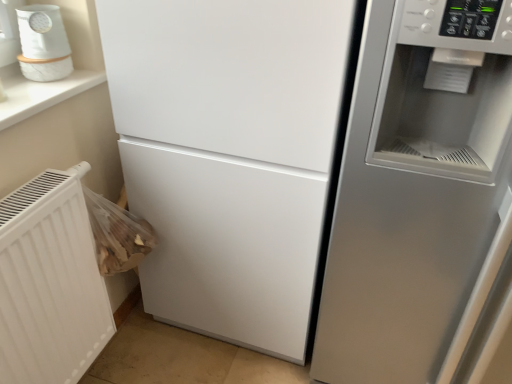
Question: From a real-world perspective, is satin silver fridge at right under white textured radiator at lower left?

Choices:
 (A) yes
 (B) no

Answer: (B)

Question: Does satin silver fridge at right have a larger size compared to white textured radiator at lower left?

Choices:
 (A) yes
 (B) no

Answer: (A)

Question: Is satin silver fridge at right wider than white textured radiator at lower left?

Choices:
 (A) yes
 (B) no

Answer: (A)

Question: Does satin silver fridge at right have a greater height compared to white textured radiator at lower left?

Choices:
 (A) yes
 (B) no

Answer: (A)

Question: Considering the relative positions of satin silver fridge at right and white textured radiator at lower left in the image provided, is satin silver fridge at right behind white textured radiator at lower left?

Choices:
 (A) no
 (B) yes

Answer: (A)

Question: Based on their positions, is white glossy humidifier at upper left located to the left or right of satin silver fridge at right?

Choices:
 (A) left
 (B) right

Answer: (A)

Question: Would you say white glossy humidifier at upper left is inside or outside satin silver fridge at right?

Choices:
 (A) inside
 (B) outside

Answer: (B)

Question: In the image, is white glossy humidifier at upper left positioned in front of or behind satin silver fridge at right?

Choices:
 (A) behind
 (B) front

Answer: (A)

Question: From a real-world perspective, relative to satin silver fridge at right, is white glossy humidifier at upper left vertically above or below?

Choices:
 (A) above
 (B) below

Answer: (A)

Question: Does point (47, 352) appear closer or farther from the camera than point (366, 266)?

Choices:
 (A) farther
 (B) closer

Answer: (A)

Question: Is white textured radiator at lower left inside the boundaries of satin silver fridge at right, or outside?

Choices:
 (A) inside
 (B) outside

Answer: (B)

Question: Considering the positions of white textured radiator at lower left and satin silver fridge at right in the image, is white textured radiator at lower left wider or thinner than satin silver fridge at right?

Choices:
 (A) thin
 (B) wide

Answer: (A)

Question: From the image's perspective, relative to satin silver fridge at right, is white textured radiator at lower left above or below?

Choices:
 (A) below
 (B) above

Answer: (A)

Question: In the image, is white textured radiator at lower left positioned in front of or behind white glossy humidifier at upper left?

Choices:
 (A) front
 (B) behind

Answer: (A)

Question: From a real-world perspective, is white textured radiator at lower left positioned above or below white glossy humidifier at upper left?

Choices:
 (A) above
 (B) below

Answer: (B)